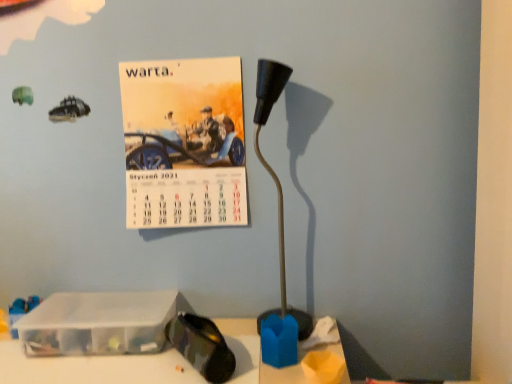
Question: Is point (169, 291) positioned closer to the camera than point (266, 89)?

Choices:
 (A) closer
 (B) farther

Answer: (B)

Question: In the image, is transparent plastic container at lower left positioned in front of or behind black plastic lamp at center?

Choices:
 (A) front
 (B) behind

Answer: (B)

Question: Considering the real-world distances, which object is farthest from the matte paper calendar at upper left?

Choices:
 (A) transparent plastic container at lower left
 (B) black plastic lamp at center

Answer: (A)

Question: Which object is positioned closest to the transparent plastic container at lower left?

Choices:
 (A) black plastic lamp at center
 (B) matte paper calendar at upper left

Answer: (B)